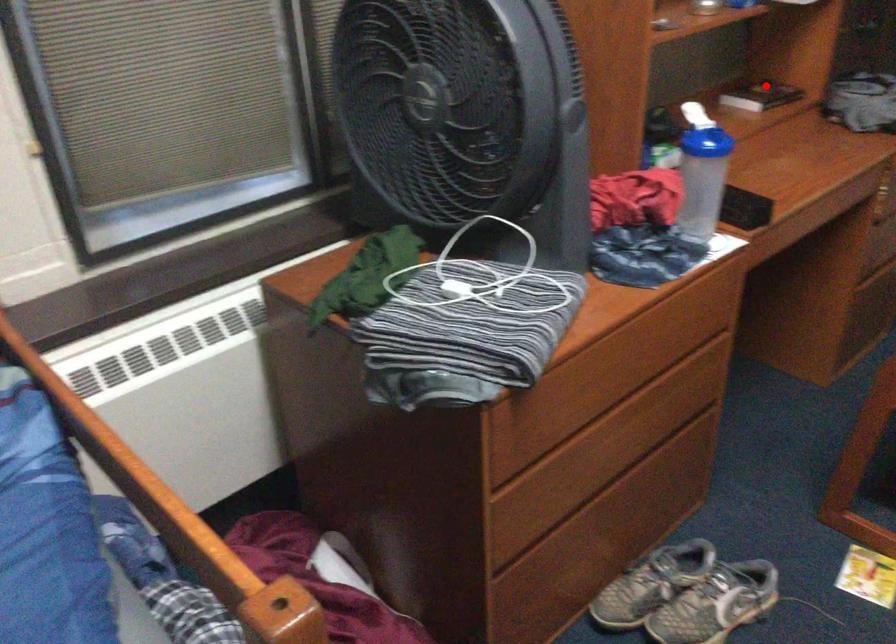
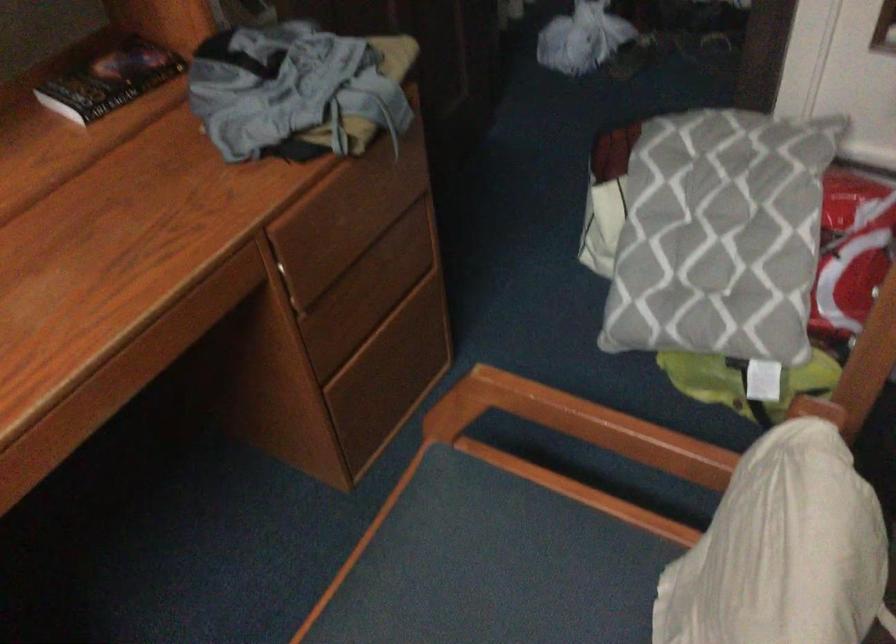
Question: I am providing you with two images of the same scene from different viewpoints. In image1, a red point is highlighted. Considering the same 3D point in image2, which of the following is correct?

Choices:
 (A) It is closer
 (B) It is farther

Answer: (A)